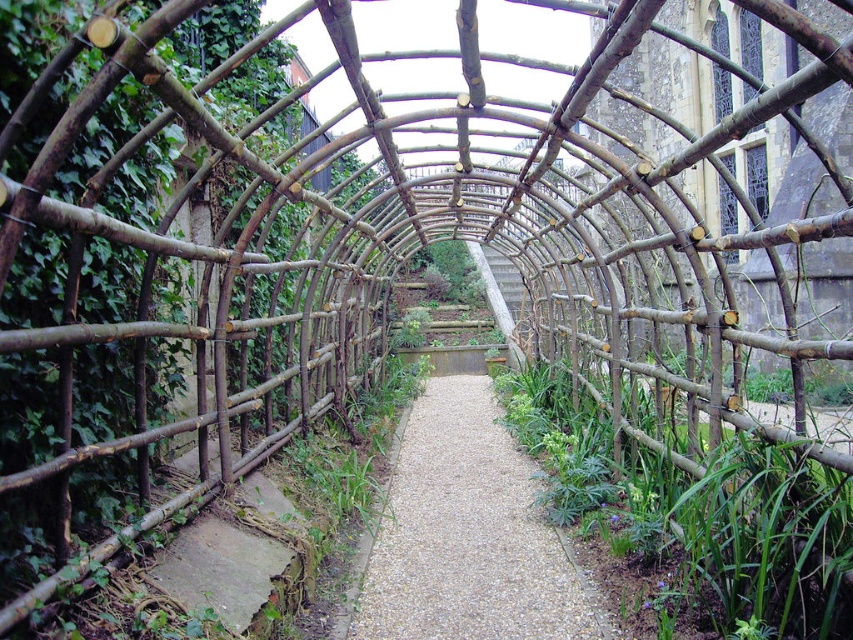
You are standing at the entrance of the garden pathway and want to take a photo of both the point at coordinates (393, 547) and the point at coordinates (474, 289). Since you can only focus on one point at a time, which point should you focus on to ensure the other point remains in the background?

You should focus on point (393, 547) because it is closer to the camera than point (474, 289), so the farther point will naturally be in the background.

You are standing at the entrance of the garden and want to walk to the arbor. Which direction should you head to follow the gravelly stone path at center?

The gravelly stone path at center is located at point (x=468, y=536), so you should head towards the center of the garden to follow the gravelly stone path at center.

Based on the photo, you are standing at the entrance of the garden and want to walk towards the gravelly stone path at center. As you move forward, will the natural wood trellis at left block your view of the path?

The natural wood trellis at left is in front of the gravelly stone path at center, so it will block your view of the path as you approach.